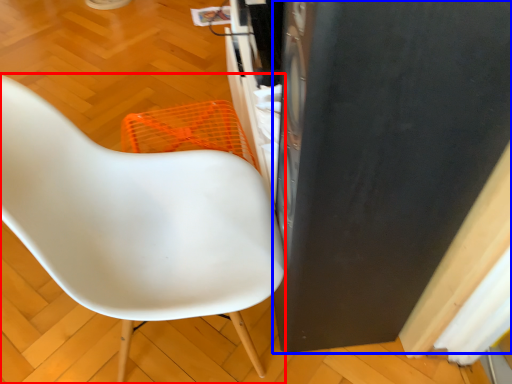
Question: Which point is closer to the camera, chair (highlighted by a red box) or appliance (highlighted by a blue box)?

Choices:
 (A) chair
 (B) appliance

Answer: (B)